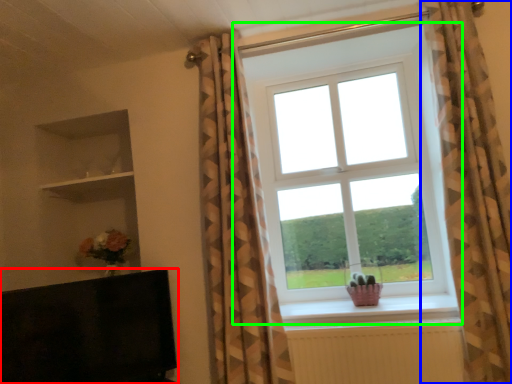
Question: Which object is positioned farthest from furniture (highlighted by a red box)? Select from curtain (highlighted by a blue box) and window (highlighted by a green box).

Choices:
 (A) curtain
 (B) window

Answer: (A)